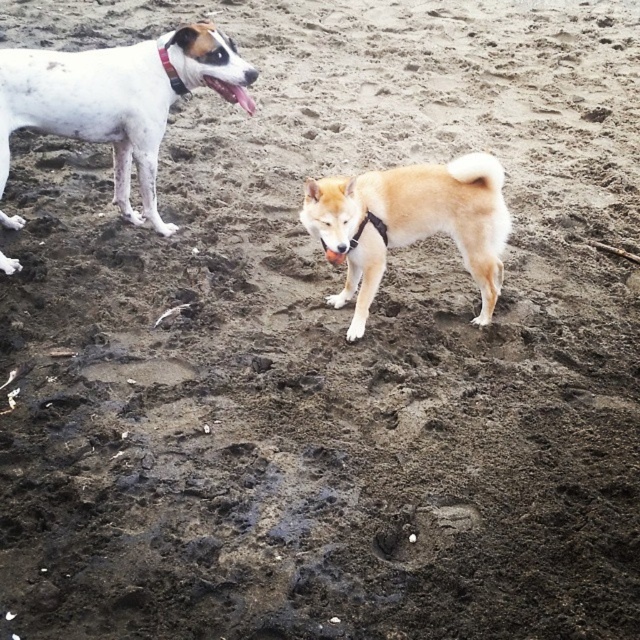
Question: Can you confirm if light brown fur at center is bigger than black fabric neckband at upper left?

Choices:
 (A) yes
 (B) no

Answer: (A)

Question: Observing the image, what is the correct spatial positioning of light brown fur at center in reference to black fabric neckband at upper left?

Choices:
 (A) left
 (B) right

Answer: (B)

Question: Observing the image, what is the correct spatial positioning of light brown fur at center in reference to black fabric neckband at upper left?

Choices:
 (A) left
 (B) right

Answer: (B)

Question: Estimate the real-world distances between objects in this image. Which object is closer to the light brown fur at center?

Choices:
 (A) white fur dog at upper left
 (B) black fabric neckband at upper left

Answer: (A)

Question: Based on their relative distances, which object is nearer to the light brown fur at center?

Choices:
 (A) white fur dog at upper left
 (B) black fabric neckband at upper left

Answer: (A)

Question: Which object is the farthest from the black fabric neckband at upper left?

Choices:
 (A) light brown fur at center
 (B) white fur dog at upper left

Answer: (A)